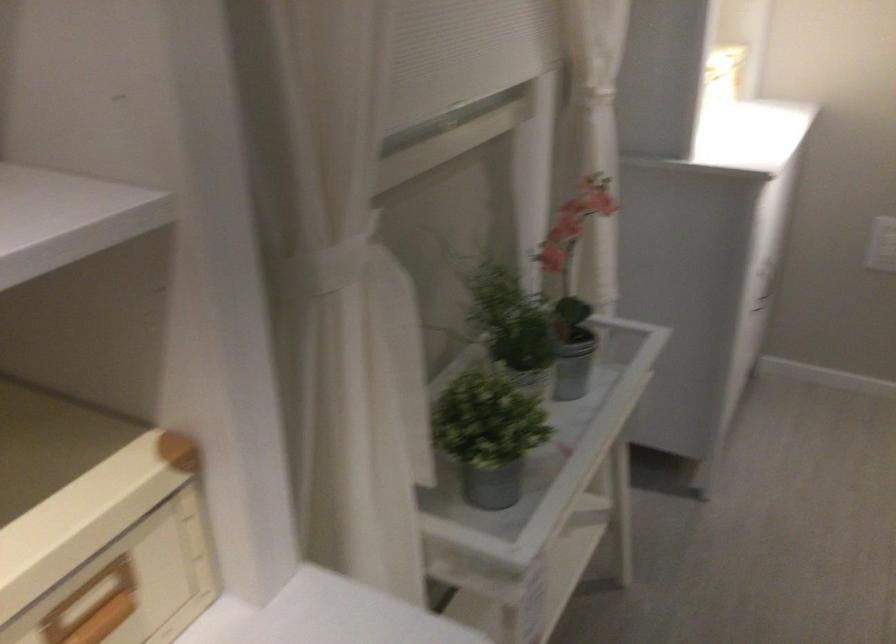
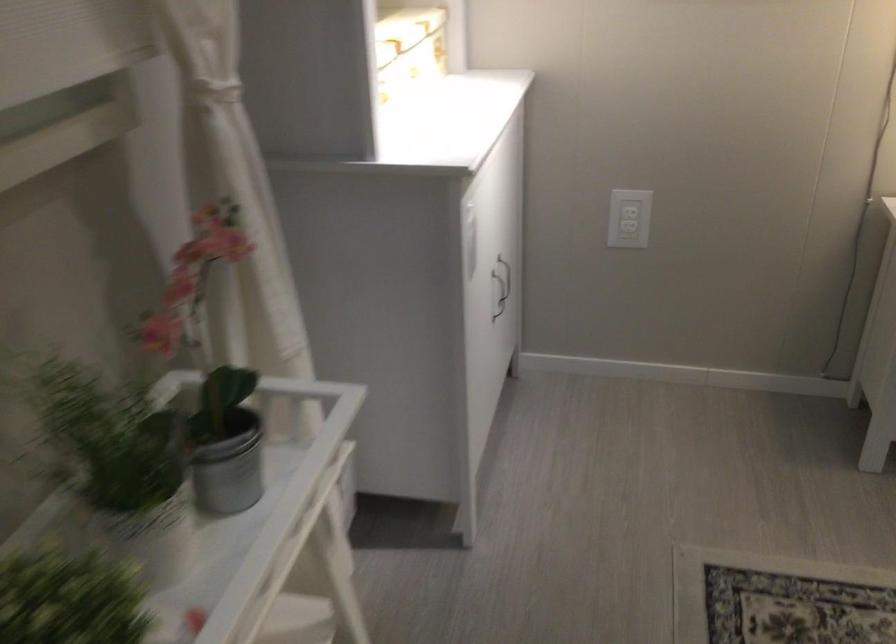
Find the pixel in the second image that matches point (567, 365) in the first image.

(227, 462)